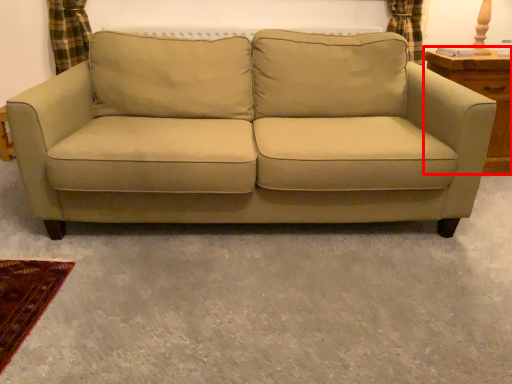
Question: Where is dresser (annotated by the red box) located in relation to studio couch in the image?

Choices:
 (A) left
 (B) right

Answer: (B)